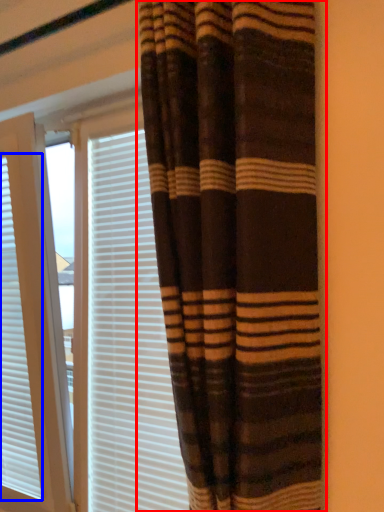
Question: Which object is further to the camera taking this photo, curtain (highlighted by a red box) or window blind (highlighted by a blue box)?

Choices:
 (A) curtain
 (B) window blind

Answer: (B)